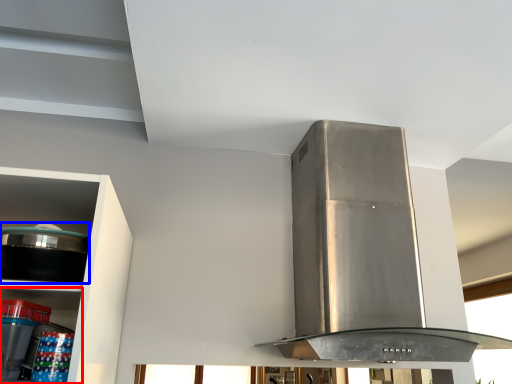
Question: Which object is further to the camera taking this photo, shelf (highlighted by a red box) or appliance (highlighted by a blue box)?

Choices:
 (A) shelf
 (B) appliance

Answer: (A)